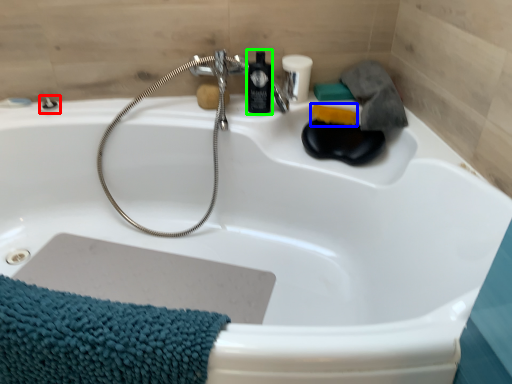
Question: Which object is the closest to the shower (highlighted by a red box)? Choose among these: soap (highlighted by a blue box) or mouthwash (highlighted by a green box).

Choices:
 (A) soap
 (B) mouthwash

Answer: (B)